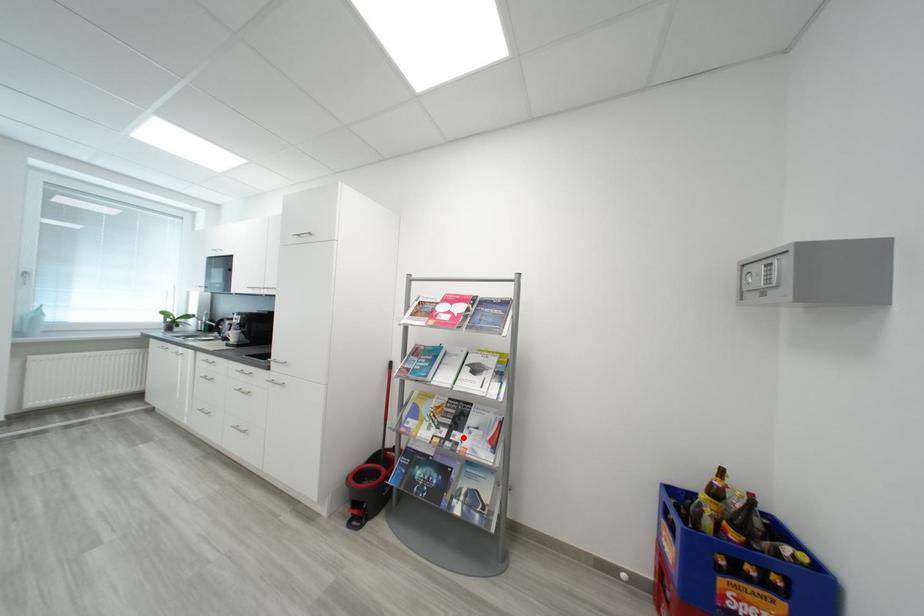
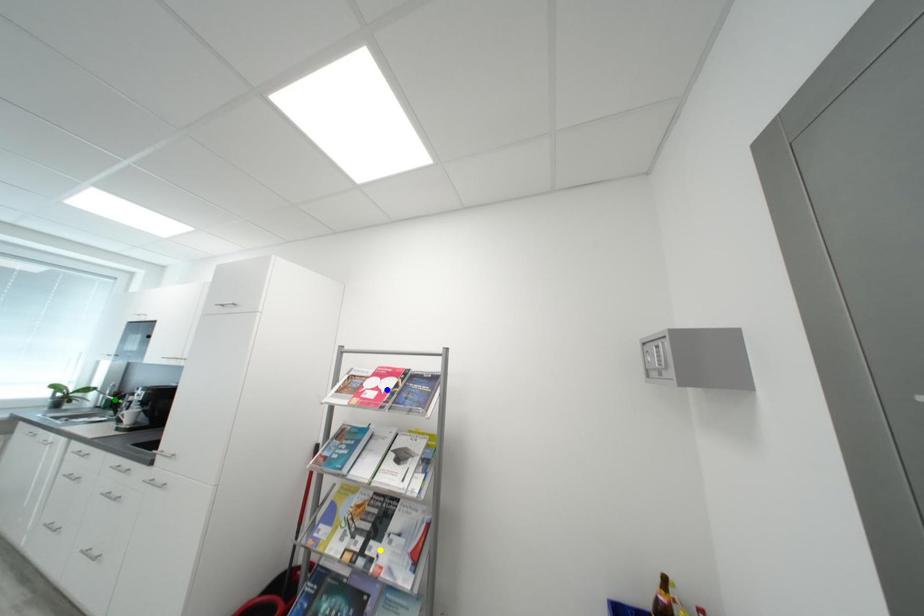
Question: I am providing you with two images of the same scene from different viewpoints. A red point is marked on the first image. You are given multiple points on the second image. Which point in image 2 represents the same 3d spot as the red point in image 1?

Choices:
 (A) blue point
 (B) green point
 (C) yellow point

Answer: (C)